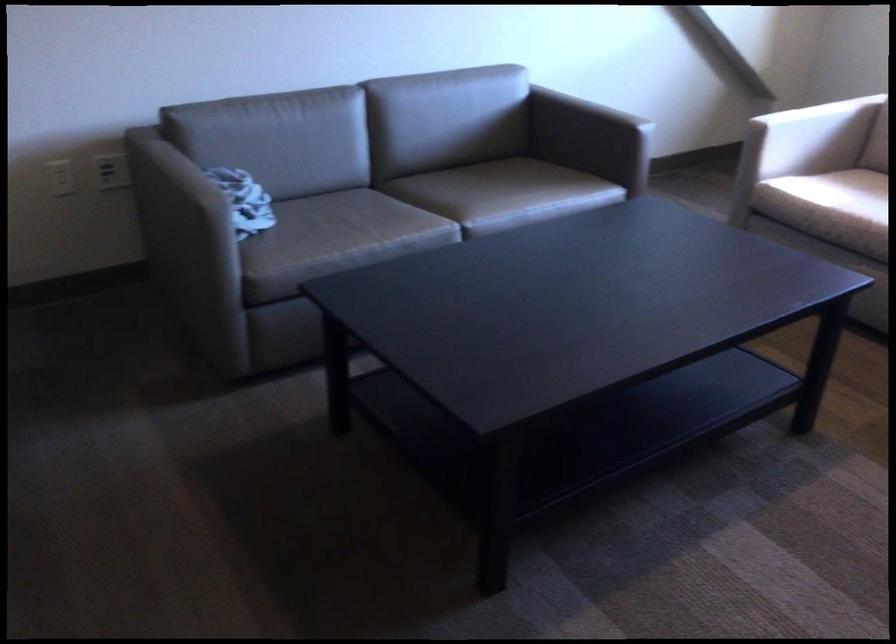
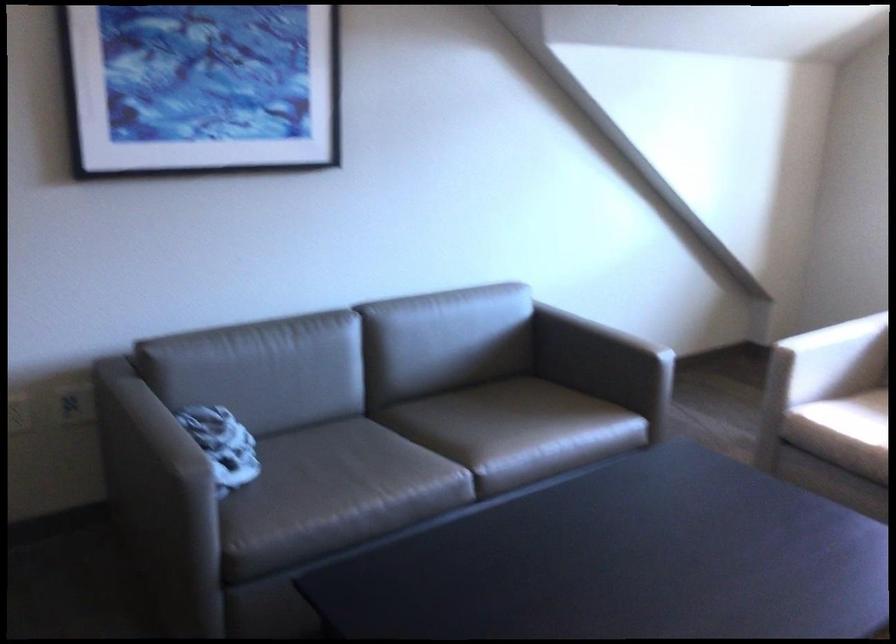
Locate, in the second image, the point that corresponds to point (805, 135) in the first image.

(831, 359)